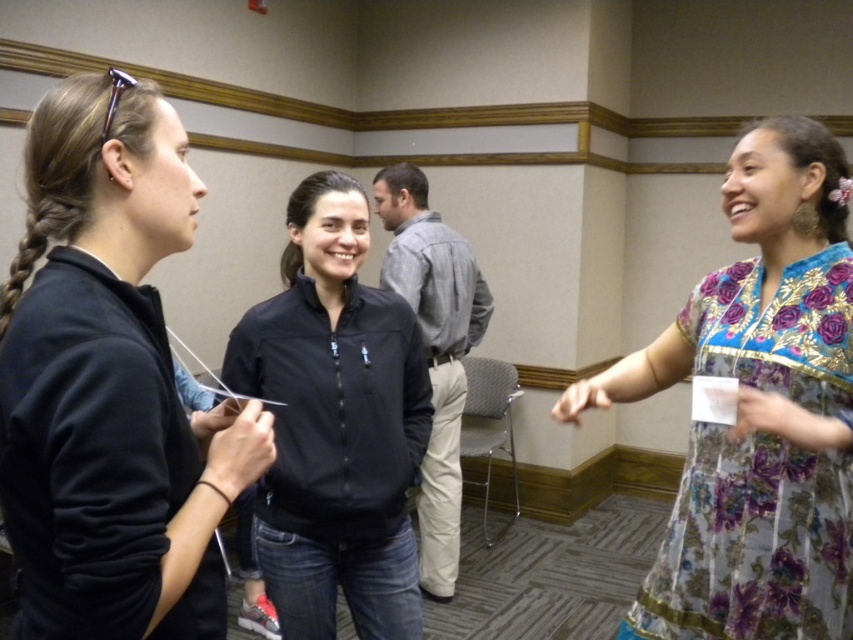
Does point (90, 435) lie in front of point (413, 220)?

Yes, it is in front of point (413, 220).

Measure the distance between matte black jacket at left and gray cotton shirt at center.

matte black jacket at left and gray cotton shirt at center are 1.99 meters apart from each other.

Is point (82, 516) positioned in front of point (448, 330)?

Yes, it is.

Identify the location of matte black jacket at left. The width and height of the screenshot is (853, 640). [x=109, y=381].

Which is more to the left, floral silk dress at right or gray cotton shirt at center?

From the viewer's perspective, gray cotton shirt at center appears more on the left side.

Between point (836, 444) and point (434, 323), which one is positioned behind?

Positioned behind is point (434, 323).

The image size is (853, 640). Find the location of `floral silk dress at right`. floral silk dress at right is located at coordinates (758, 410).

Who is positioned more to the left, matte black jacket at left or floral silk dress at right?

From the viewer's perspective, matte black jacket at left appears more on the left side.

Who is higher up, matte black jacket at left or floral silk dress at right?

matte black jacket at left

The width and height of the screenshot is (853, 640). I want to click on matte black jacket at left, so click(109, 381).

The height and width of the screenshot is (640, 853). Find the location of `matte black jacket at left`. matte black jacket at left is located at coordinates (109, 381).